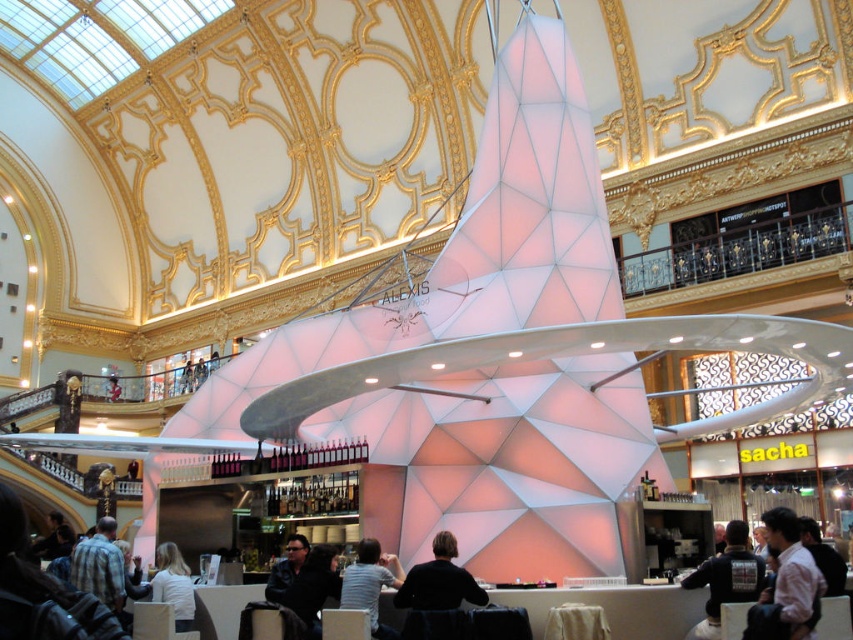
Is light pink shirt at lower right smaller than plaid shirt at lower left?

Yes.

Does light pink shirt at lower right have a greater height compared to plaid shirt at lower left?

No.

Image resolution: width=853 pixels, height=640 pixels. In order to click on light pink shirt at lower right in this screenshot , I will do `click(786, 584)`.

This screenshot has width=853, height=640. Find the location of `light pink shirt at lower right`. light pink shirt at lower right is located at coordinates (786, 584).

Is point (717, 577) positioned behind point (434, 573)?

No, it is not.

Who is positioned more to the right, dark blue jacket at lower right or silhouette leather jacket at center?

From the viewer's perspective, dark blue jacket at lower right appears more on the right side.

You are a GUI agent. You are given a task and a screenshot of the screen. Output one action in this format:
    pyautogui.click(x=<x>, y=<y>)
    Task: Click on the dark blue jacket at lower right
    This screenshot has height=640, width=853.
    Given the screenshot: What is the action you would take?
    pyautogui.click(x=726, y=579)

Can you confirm if silhouette leather jacket at center is wider than dark hair at lower left?

No, silhouette leather jacket at center is not wider than dark hair at lower left.

Which is behind, point (457, 579) or point (50, 518)?

The point (50, 518) is more distant.

Where is `silhouette leather jacket at center`? The height and width of the screenshot is (640, 853). silhouette leather jacket at center is located at coordinates (439, 580).